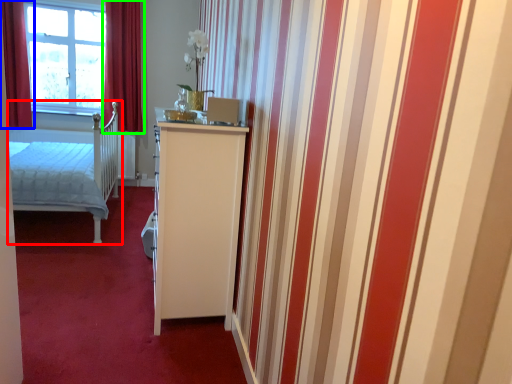
Question: Estimate the real-world distances between objects in this image. Which object is closer to bed (highlighted by a red box), curtain (highlighted by a blue box) or curtain (highlighted by a green box)?

Choices:
 (A) curtain
 (B) curtain

Answer: (A)